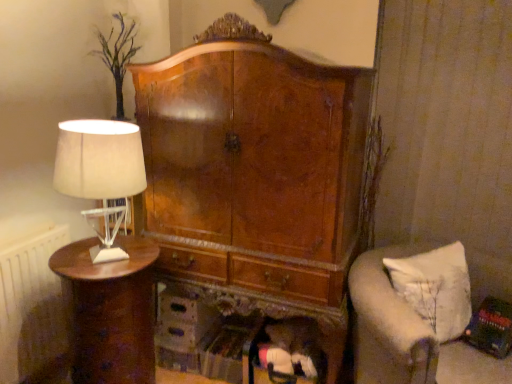
Question: Should I look upward or downward to see white fabric cushion at lower right?

Choices:
 (A) down
 (B) up

Answer: (A)

Question: Can you confirm if white fabric lampshade at left is positioned to the left of shiny brown wood nightstand at left?

Choices:
 (A) no
 (B) yes

Answer: (A)

Question: Does white fabric lampshade at left lie behind shiny brown wood nightstand at left?

Choices:
 (A) yes
 (B) no

Answer: (B)

Question: Is white fabric lampshade at left looking in the opposite direction of shiny brown wood nightstand at left?

Choices:
 (A) no
 (B) yes

Answer: (A)

Question: Is shiny brown wood nightstand at left located within white fabric lampshade at left?

Choices:
 (A) no
 (B) yes

Answer: (A)

Question: From the image's perspective, would you say white fabric lampshade at left is shown under shiny brown wood nightstand at left?

Choices:
 (A) yes
 (B) no

Answer: (B)

Question: Is white fabric lampshade at left in front of shiny brown wood nightstand at left?

Choices:
 (A) no
 (B) yes

Answer: (B)

Question: Does white fabric cushion at lower right have a greater height compared to shiny brown wood nightstand at left?

Choices:
 (A) no
 (B) yes

Answer: (A)

Question: Is white fabric cushion at lower right bigger than shiny brown wood nightstand at left?

Choices:
 (A) yes
 (B) no

Answer: (B)

Question: Can you confirm if white fabric cushion at lower right is smaller than shiny brown wood nightstand at left?

Choices:
 (A) no
 (B) yes

Answer: (B)

Question: Is white fabric cushion at lower right next to shiny brown wood nightstand at left?

Choices:
 (A) no
 (B) yes

Answer: (A)

Question: Does white fabric cushion at lower right turn towards shiny brown wood nightstand at left?

Choices:
 (A) yes
 (B) no

Answer: (B)

Question: From the image's perspective, is white fabric cushion at lower right below shiny brown wood nightstand at left?

Choices:
 (A) no
 (B) yes

Answer: (A)

Question: Is white fabric cushion at lower right not near white radiator at left?

Choices:
 (A) no
 (B) yes

Answer: (B)